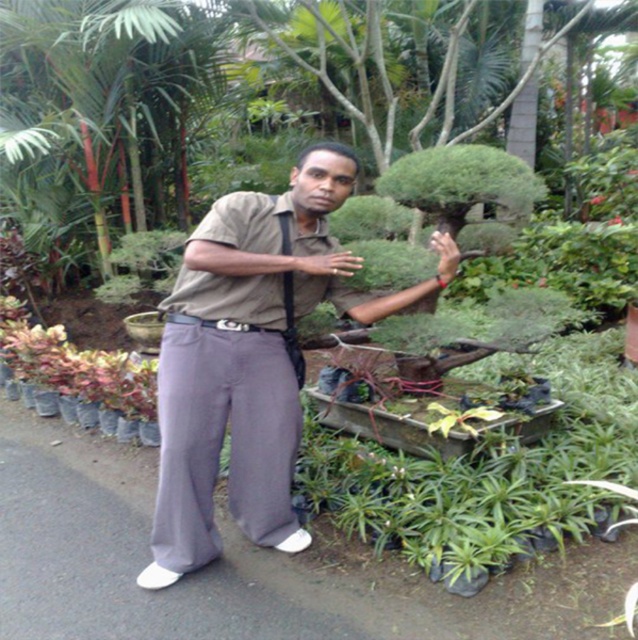
Between green matte bonsai tree at center and green matte flower at center, which one has less height?

Standing shorter between the two is green matte flower at center.

Which is behind, point (369, 108) or point (598, 198)?

The point (598, 198) is more distant.

Identify the location of green matte bonsai tree at center. This screenshot has height=640, width=638. (225, 74).

Between point (597, 198) and point (611, 225), which one is positioned in front?

Point (611, 225)

Can you confirm if green matte flower at center is taller than red matte flower at upper center?

No, green matte flower at center is not taller than red matte flower at upper center.

Does point (595, 195) lie in front of point (605, 221)?

No.

Locate an element on the screen. The image size is (638, 640). green matte flower at center is located at coordinates (597, 198).

Consider the image. Does green matte leaf at center appear over green leafy plant at center?

No.

Is green matte leaf at center below green leafy plant at center?

Correct, green matte leaf at center is located below green leafy plant at center.

Is point (538, 285) positioned after point (634, 173)?

That is False.

Identify the location of green matte leaf at center. The width and height of the screenshot is (638, 640). (542, 282).